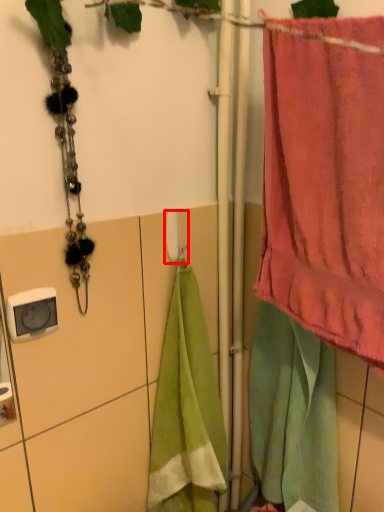
Question: From the image's perspective, what is the correct spatial positioning of towel bar (annotated by the red box) in reference to towel?

Choices:
 (A) above
 (B) below

Answer: (B)